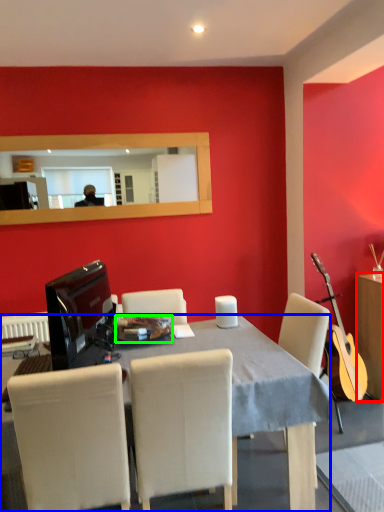
Question: Based on their relative distances, which object is farther from cabinetry (highlighted by a red box)? Choose from desk (highlighted by a blue box) and plate (highlighted by a green box).

Choices:
 (A) desk
 (B) plate

Answer: (B)